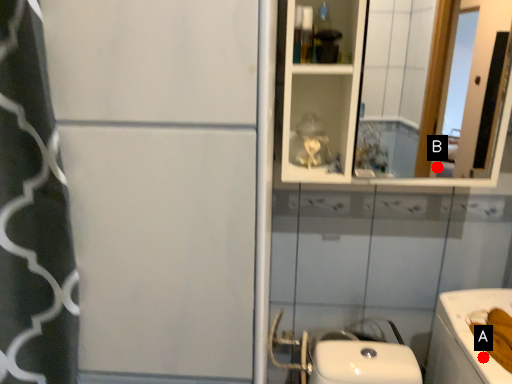
Question: Two points are circled on the image, labeled by A and B beside each circle. Which point is closer to the camera taking this photo?

Choices:
 (A) A is closer
 (B) B is closer

Answer: (A)